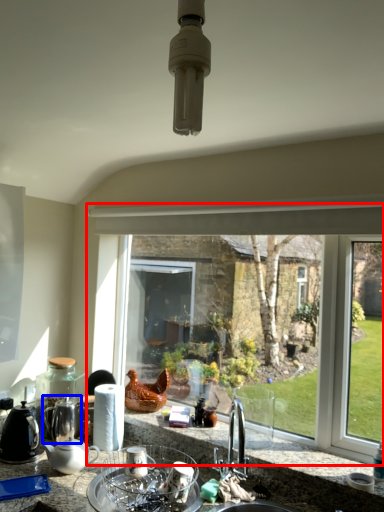
Question: Which of the following is the farthest to the observer, window (highlighted by a red box) or tea pot (highlighted by a blue box)?

Choices:
 (A) window
 (B) tea pot

Answer: (B)